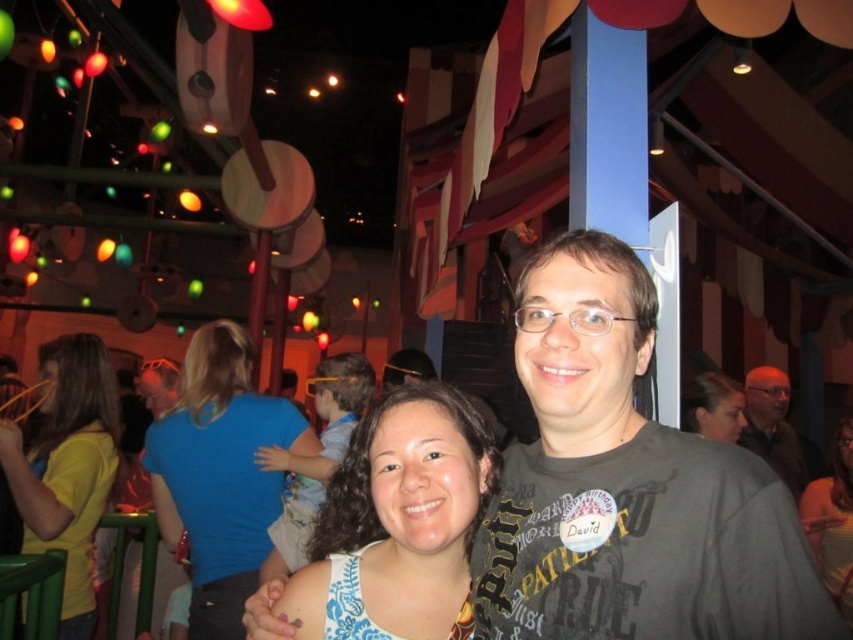
Question: Which point is closer to the camera?

Choices:
 (A) (221, 332)
 (B) (85, 568)
 (C) (717, 406)

Answer: (B)

Question: Among these objects, which one is farthest from the camera?

Choices:
 (A) gray fabric shirt at center
 (B) matte gray t-shirt at center
 (C) blue printed dress at center
 (D) yellow matte shirt at left

Answer: (A)

Question: Is blue printed dress at center to the left of white fabric shirt at center from the viewer's perspective?

Choices:
 (A) no
 (B) yes

Answer: (B)

Question: Which of the following is the closest to the observer?

Choices:
 (A) (345, 404)
 (B) (839, 442)
 (C) (289, 445)

Answer: (C)

Question: Can you confirm if matte gray t-shirt at center is positioned below smooth brown hair at center?

Choices:
 (A) yes
 (B) no

Answer: (A)

Question: Can you confirm if gray cotton t-shirt at center is positioned to the left of matte gray t-shirt at center?

Choices:
 (A) no
 (B) yes

Answer: (A)